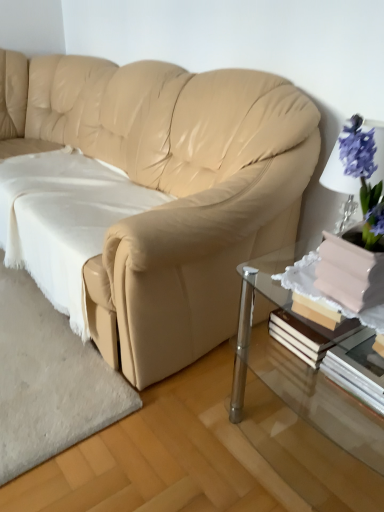
Question: Is beige leather couch at center bigger than clear glass table at lower right?

Choices:
 (A) yes
 (B) no

Answer: (A)

Question: Is beige leather couch at center not near clear glass table at lower right?

Choices:
 (A) no
 (B) yes

Answer: (A)

Question: Is beige leather couch at center facing away from clear glass table at lower right?

Choices:
 (A) no
 (B) yes

Answer: (A)

Question: From a real-world perspective, is beige leather couch at center physically below clear glass table at lower right?

Choices:
 (A) no
 (B) yes

Answer: (A)

Question: Can you confirm if beige leather couch at center is smaller than clear glass table at lower right?

Choices:
 (A) yes
 (B) no

Answer: (B)

Question: Can you confirm if beige leather couch at center is positioned to the left of clear glass table at lower right?

Choices:
 (A) no
 (B) yes

Answer: (B)

Question: From the image's perspective, is clear glass table at lower right beneath white paper book at lower right?

Choices:
 (A) yes
 (B) no

Answer: (A)

Question: From a real-world perspective, is clear glass table at lower right under white paper book at lower right?

Choices:
 (A) no
 (B) yes

Answer: (B)

Question: Is clear glass table at lower right bigger than white paper book at lower right?

Choices:
 (A) yes
 (B) no

Answer: (A)

Question: Considering the relative sizes of clear glass table at lower right and white paper book at lower right in the image provided, is clear glass table at lower right taller than white paper book at lower right?

Choices:
 (A) no
 (B) yes

Answer: (B)

Question: Would you say clear glass table at lower right contains white paper book at lower right?

Choices:
 (A) yes
 (B) no

Answer: (A)

Question: Does clear glass table at lower right have a smaller size compared to white paper book at lower right?

Choices:
 (A) yes
 (B) no

Answer: (B)

Question: Is white soft fabric at lower left to the right of white paper book at lower right from the viewer's perspective?

Choices:
 (A) yes
 (B) no

Answer: (B)